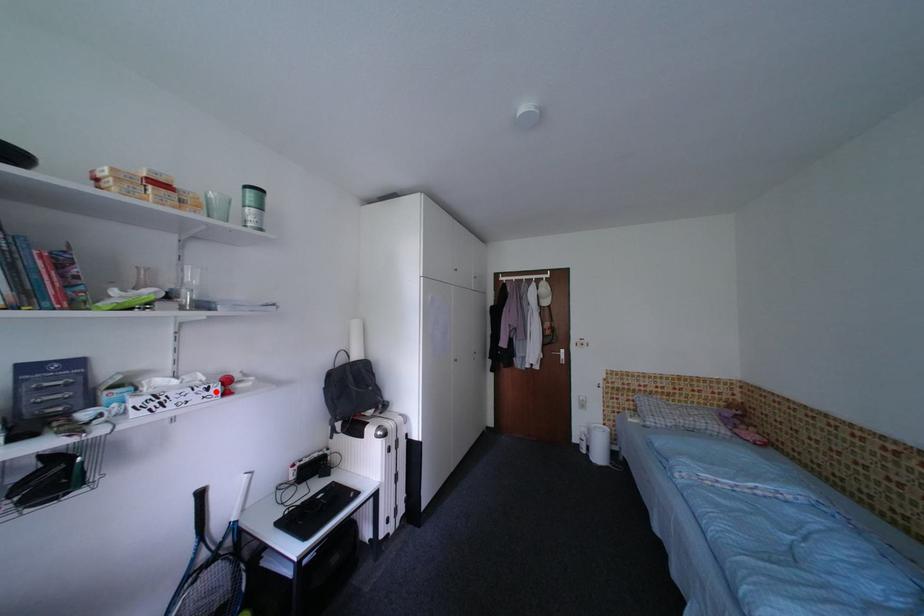
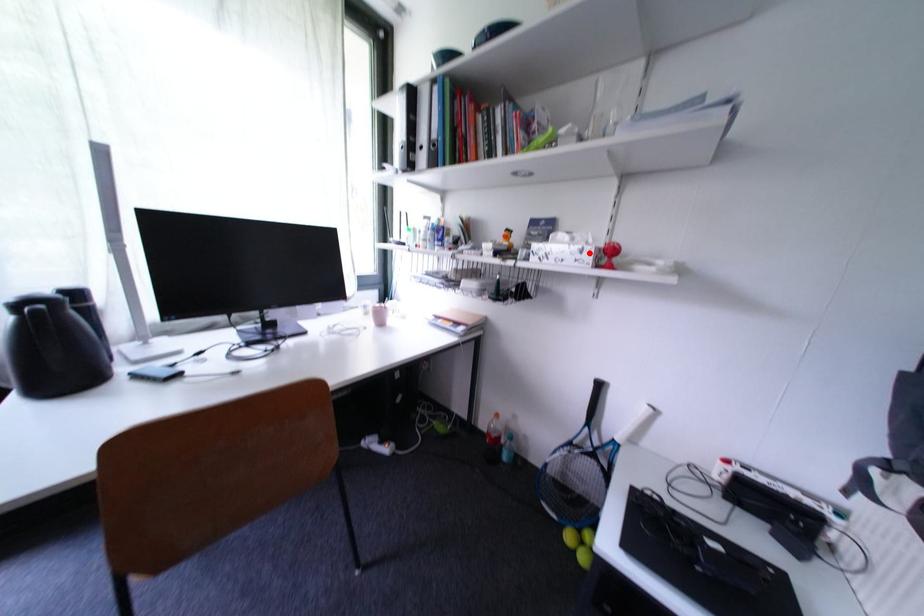
Consider the image. I am providing you with two images of the same scene from different viewpoints. A red point is marked on the first image and another point is marked on the second image. Are the points marked in image1 and image2 representing the same 3D position?

Yes